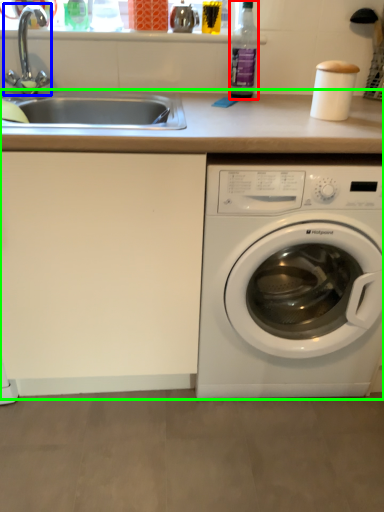
Question: Which is farther away from bottle (highlighted by a red box)? faucet (highlighted by a blue box) or counter top (highlighted by a green box)?

Choices:
 (A) faucet
 (B) counter top

Answer: (B)